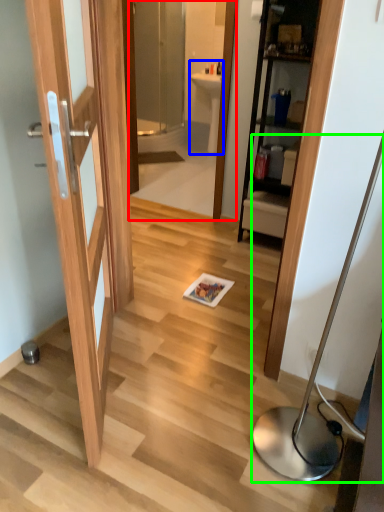
Question: Which is nearer to the mirror (highlighted by a red box)? sink (highlighted by a blue box) or table lamp (highlighted by a green box).

Choices:
 (A) sink
 (B) table lamp

Answer: (A)